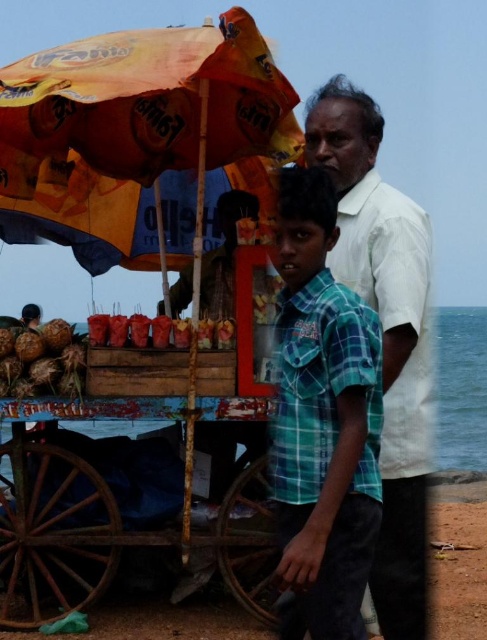
Does green plaid shirt at center come behind brown rough coconuts at lower left?

No, it is in front of brown rough coconuts at lower left.

Is point (325, 332) positioned behind point (47, 364)?

No, it is not.

Where is `green plaid shirt at center`? green plaid shirt at center is located at coordinates (322, 420).

Between green plaid shirt at center and white cotton shirt at upper center, which one has more height?

white cotton shirt at upper center is taller.

Does green plaid shirt at center appear on the left side of white cotton shirt at upper center?

Yes, green plaid shirt at center is to the left of white cotton shirt at upper center.

Is point (332, 388) farther from camera compared to point (396, 545)?

No.

Locate an element on the screen. The height and width of the screenshot is (640, 487). green plaid shirt at center is located at coordinates (322, 420).

Measure the distance between green plaid shirt at center and shiny red skewers at center.

green plaid shirt at center and shiny red skewers at center are 5.71 feet apart.

Who is taller, green plaid shirt at center or shiny red skewers at center?

Standing taller between the two is green plaid shirt at center.

Image resolution: width=487 pixels, height=640 pixels. I want to click on green plaid shirt at center, so click(x=322, y=420).